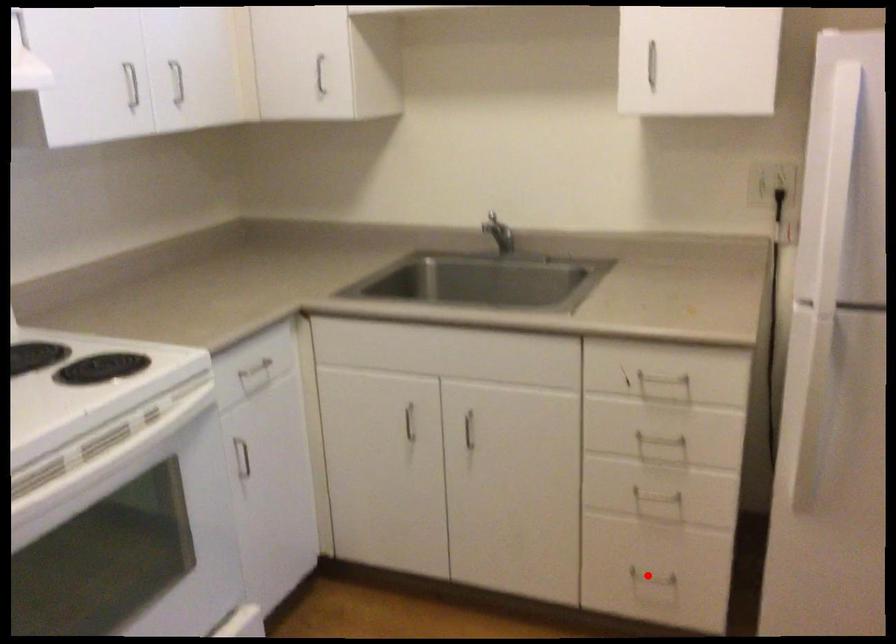
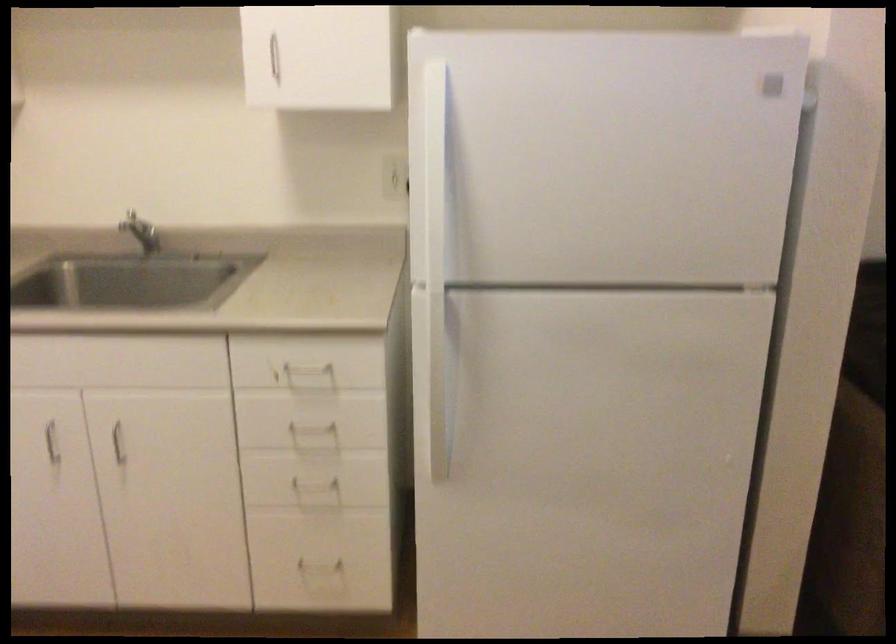
Question: I am providing you with two images of the same scene from different viewpoints. A red point is marked on the first image. Can you still see the location of the red point in image 2?

Choices:
 (A) Yes
 (B) No

Answer: (A)